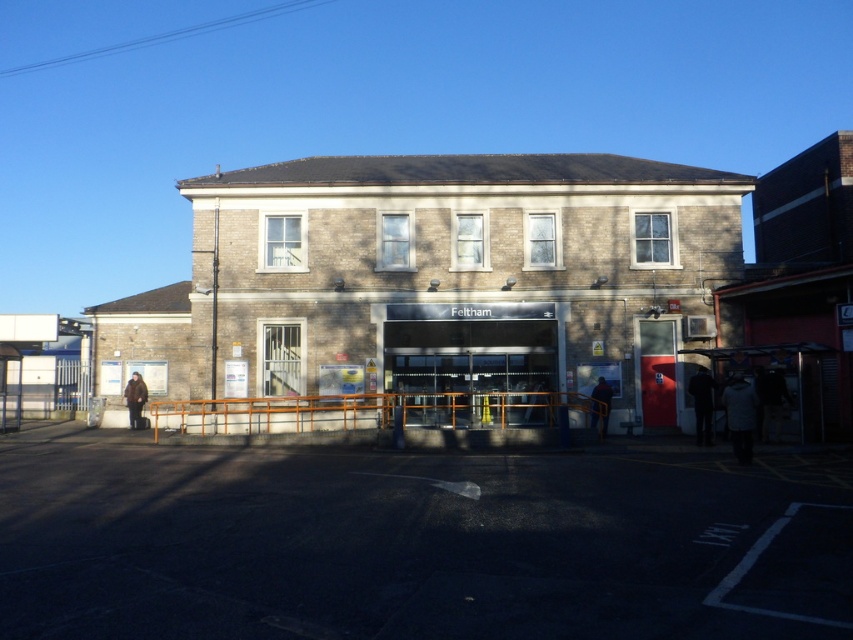
You are a photographer trying to capture a person wearing dark blue jacket at right and dark blue jeans at center in the same frame. Which clothing item should you focus on first to ensure both are in the frame?

The dark blue jacket at right has a smaller size compared to dark blue jeans at center, so you should focus on the dark blue jeans at center first to ensure both are in the frame.

You are a passenger at Feltham station and want to find the person wearing the dark blue jacket at right. Where should you look relative to the brown fuzzy coat at lower left?

The dark blue jacket at right is in front of the brown fuzzy coat at lower left, so you should look towards the area closer to the entrance or towards the front of the station relative to the brown fuzzy coat at lower left.

You are a delivery person standing at the entrance of Feltham station. You need to place two packages at specific coordinates. The first package must be placed at point (705, 412) and the second at point (608, 408). Based on the image, which package is closer to the entrance?

The package at point (705, 412) is closer to the entrance because it is in front of point (608, 408).